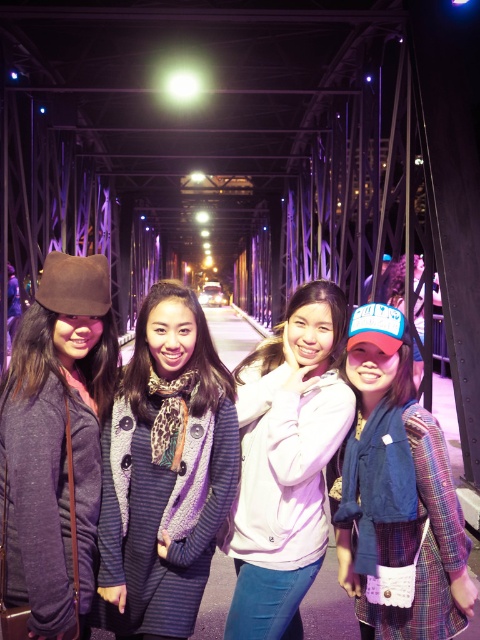
Who is lower down, brown suede hat at left or pink fleece jacket at center?

pink fleece jacket at center is lower down.

Is brown suede hat at left in front of pink fleece jacket at center?

Yes, it is.

Between point (68, 346) and point (336, 340), which one is positioned in front?

Point (68, 346) is in front.

In order to click on brown suede hat at left in this screenshot , I will do `click(56, 438)`.

Is striped wool coat at center taller than pink fleece jacket at center?

No, striped wool coat at center is not taller than pink fleece jacket at center.

Is point (216, 408) closer to camera compared to point (324, 406)?

Yes, it is.

At what (x,y) coordinates should I click in order to perform the action: click on striped wool coat at center. Please return your answer as a coordinate pair (x, y). Looking at the image, I should click on (165, 472).

Can you confirm if striped wool coat at center is positioned above brown suede hat at left?

No, striped wool coat at center is not above brown suede hat at left.

Who is more forward, (180, 609) or (37, 598)?

Positioned in front is point (37, 598).

Where is `striped wool coat at center`? The image size is (480, 640). striped wool coat at center is located at coordinates (165, 472).

The width and height of the screenshot is (480, 640). In order to click on striped wool coat at center in this screenshot , I will do `click(165, 472)`.